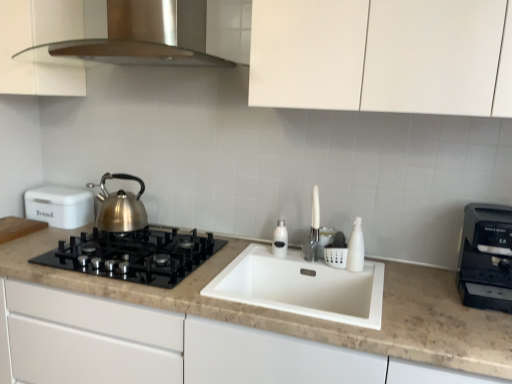
Question: Considering the relative sizes of black glass gas stove at left and brushed metal kettle at left in the image provided, is black glass gas stove at left shorter than brushed metal kettle at left?

Choices:
 (A) no
 (B) yes

Answer: (B)

Question: Can you confirm if black glass gas stove at left is positioned to the right of brushed metal kettle at left?

Choices:
 (A) yes
 (B) no

Answer: (A)

Question: From a real-world perspective, does black glass gas stove at left sit lower than brushed metal kettle at left?

Choices:
 (A) no
 (B) yes

Answer: (B)

Question: Considering the relative positions of black glass gas stove at left and brushed metal kettle at left in the image provided, is black glass gas stove at left to the left of brushed metal kettle at left from the viewer's perspective?

Choices:
 (A) no
 (B) yes

Answer: (A)

Question: Considering the relative sizes of black glass gas stove at left and brushed metal kettle at left in the image provided, is black glass gas stove at left taller than brushed metal kettle at left?

Choices:
 (A) yes
 (B) no

Answer: (B)

Question: Does black glass gas stove at left come in front of brushed metal kettle at left?

Choices:
 (A) yes
 (B) no

Answer: (A)

Question: Can you confirm if brushed metal kettle at left is thinner than white matte cabinet at upper left?

Choices:
 (A) yes
 (B) no

Answer: (A)

Question: Can you confirm if brushed metal kettle at left is taller than white matte cabinet at upper left?

Choices:
 (A) yes
 (B) no

Answer: (B)

Question: Is brushed metal kettle at left in contact with white matte cabinet at upper left?

Choices:
 (A) no
 (B) yes

Answer: (A)

Question: From the image's perspective, is brushed metal kettle at left located beneath white matte cabinet at upper left?

Choices:
 (A) no
 (B) yes

Answer: (B)

Question: Is brushed metal kettle at left positioned with its back to white matte cabinet at upper left?

Choices:
 (A) yes
 (B) no

Answer: (B)

Question: Does brushed metal kettle at left appear on the left side of white matte cabinet at upper left?

Choices:
 (A) yes
 (B) no

Answer: (B)

Question: Is satin silver range hood at upper center to the right of black plastic toaster at right, arranged as the second kitchen appliance when viewed from the left, from the viewer's perspective?

Choices:
 (A) yes
 (B) no

Answer: (B)